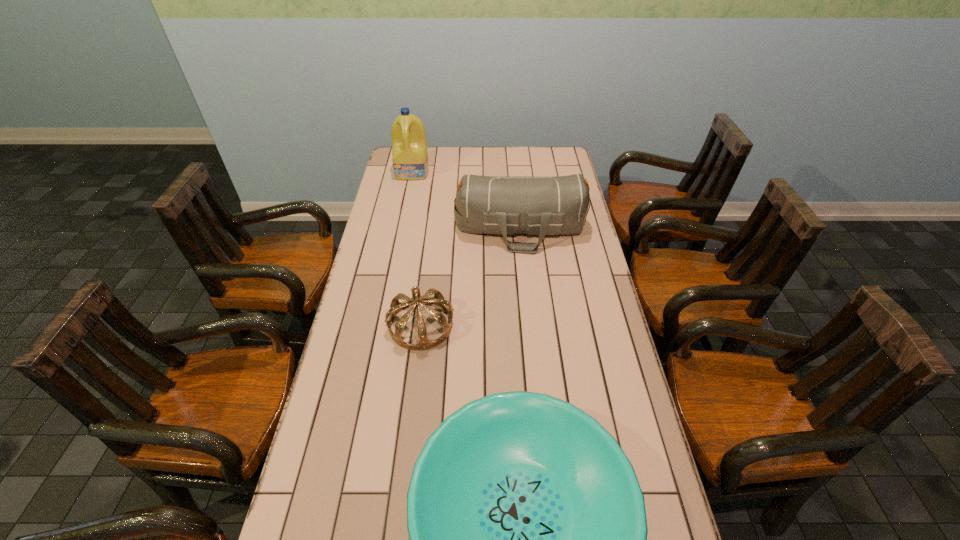
Identify the location of detergent that is at the left edge. (409, 146).

Where is `tiara at the left edge`? Image resolution: width=960 pixels, height=540 pixels. tiara at the left edge is located at coordinates (438, 299).

At what (x,y) coordinates should I click in order to perform the action: click on object that is at the right edge. Please return your answer as a coordinate pair (x, y). Image resolution: width=960 pixels, height=540 pixels. Looking at the image, I should click on (559, 205).

Image resolution: width=960 pixels, height=540 pixels. I want to click on object at the far left corner, so click(409, 146).

This screenshot has height=540, width=960. I want to click on free point at the far edge, so pos(510,169).

The image size is (960, 540). Identify the location of vacant space at the left edge of the desktop. (350, 326).

In the image, there is a desktop. Where is `vacant space at the right edge`? This screenshot has width=960, height=540. vacant space at the right edge is located at coordinates (583, 333).

I want to click on vacant space at the far right corner of the desktop, so click(566, 163).

Where is `vacant area between the second nearest object and the second farthest object`? vacant area between the second nearest object and the second farthest object is located at coordinates (470, 276).

Locate an element on the screen. Image resolution: width=960 pixels, height=540 pixels. vacant area between the second shortest object and the third nearest object is located at coordinates (470, 276).